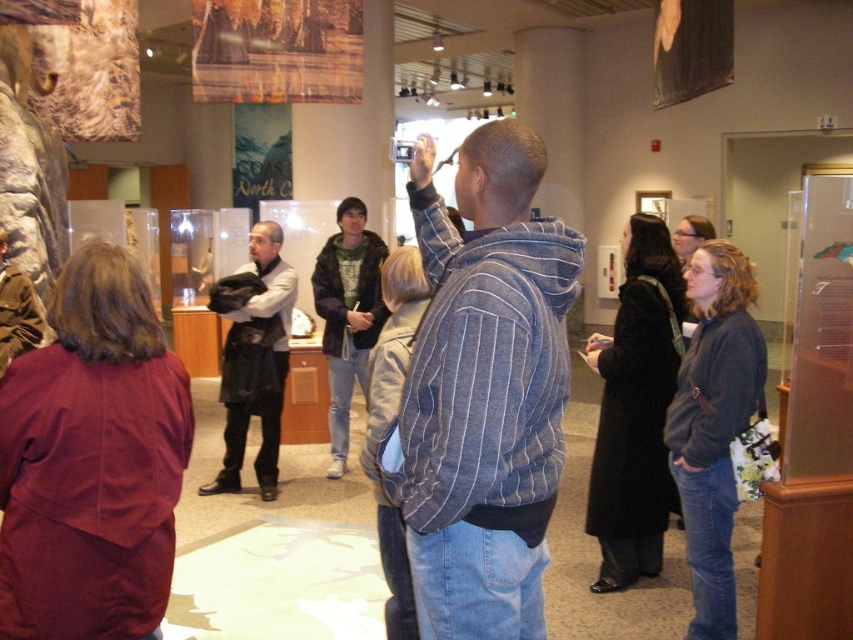
Question: Is dark gray fabric jacket at center smaller than green hoodie at center?

Choices:
 (A) no
 (B) yes

Answer: (B)

Question: Does striped denim jacket at center appear on the right side of green hoodie at center?

Choices:
 (A) no
 (B) yes

Answer: (B)

Question: Which object appears farthest from the camera in this image?

Choices:
 (A) dark gray fabric jacket at center
 (B) green hoodie at center

Answer: (A)

Question: Is striped denim jacket at center positioned in front of green hoodie at center?

Choices:
 (A) yes
 (B) no

Answer: (A)

Question: Among these points, which one is nearest to the camera?

Choices:
 (A) (318, 314)
 (B) (216, 285)

Answer: (B)

Question: Which of the following is the closest to the observer?

Choices:
 (A) (264, 372)
 (B) (332, 237)
 (C) (469, 209)

Answer: (C)